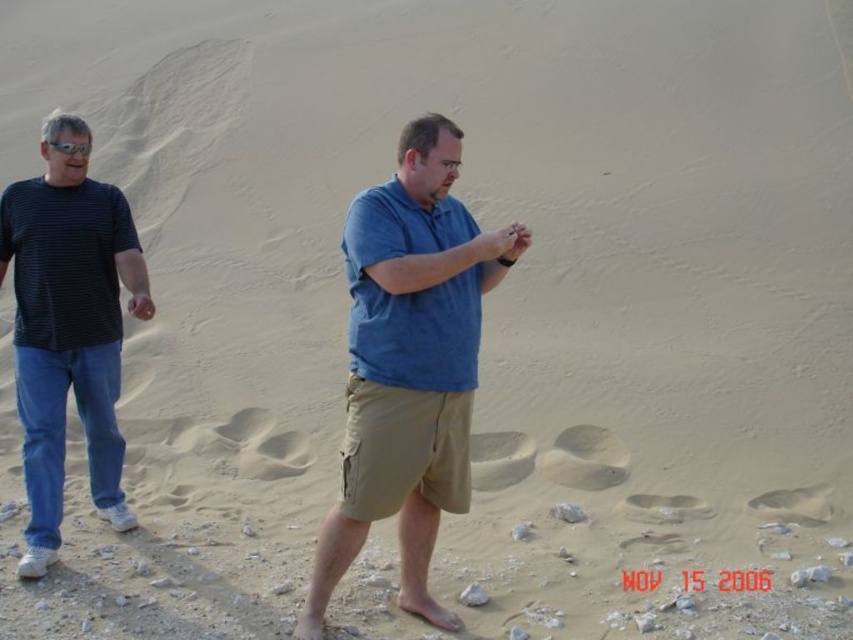
Question: Does khaki shorts at center have a lesser width compared to dark blue striped shirt at left?

Choices:
 (A) no
 (B) yes

Answer: (A)

Question: Is the position of khaki shorts at center less distant than that of dark blue striped shirt at left?

Choices:
 (A) yes
 (B) no

Answer: (A)

Question: Which point appears closest to the camera in this image?

Choices:
 (A) (107, 189)
 (B) (404, 442)

Answer: (B)

Question: Is khaki shorts at center above dark blue striped shirt at left?

Choices:
 (A) yes
 (B) no

Answer: (B)